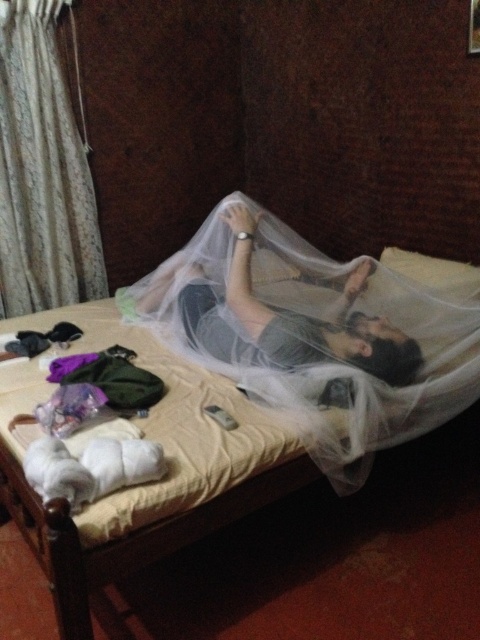
Question: Where is white mesh mosquito net at upper center located in relation to matte gray fabric at center in the image?

Choices:
 (A) above
 (B) below

Answer: (B)

Question: Which object appears closest to the camera in this image?

Choices:
 (A) white textured curtain at upper left
 (B) white mesh mosquito net at upper center

Answer: (B)

Question: Does white mesh mosquito net at upper center have a lesser width compared to matte gray fabric at center?

Choices:
 (A) yes
 (B) no

Answer: (B)

Question: Which point is farther to the camera?

Choices:
 (A) white mesh mosquito net at upper center
 (B) matte gray fabric at center
 (C) white textured curtain at upper left

Answer: (C)

Question: Can you confirm if white mesh mosquito net at upper center is smaller than white textured curtain at upper left?

Choices:
 (A) yes
 (B) no

Answer: (B)

Question: Which object is closer to the camera taking this photo?

Choices:
 (A) white mesh mosquito net at upper center
 (B) matte gray fabric at center

Answer: (A)